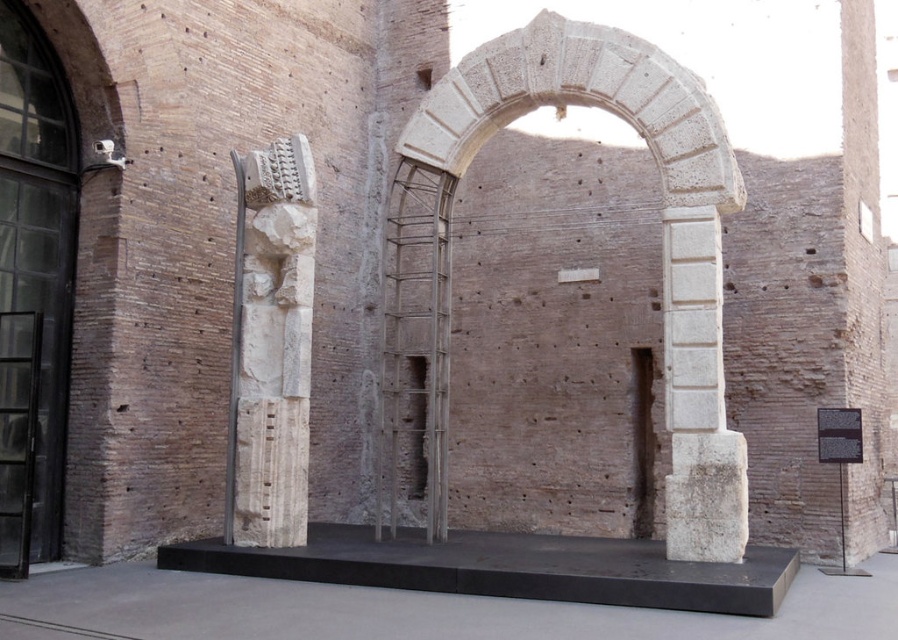
Based on the photo, you are an art student standing in front of the installation. You want to take a photo of the white marble statue at center without the white stone column at center appearing in the background. Is this possible?

The white stone column at center is behind the white marble statue at center, so if you position yourself so that the statue blocks the view of the column, you can take a photo of the white marble statue at center without the white stone column at center in the background.

You are an art student analyzing the installation. You notice both the white stone archway at center and the white marble statue at center. Which object is closer to you from your current viewpoint?

The white stone archway at center is in front of the white marble statue at center, so it is closer to you.